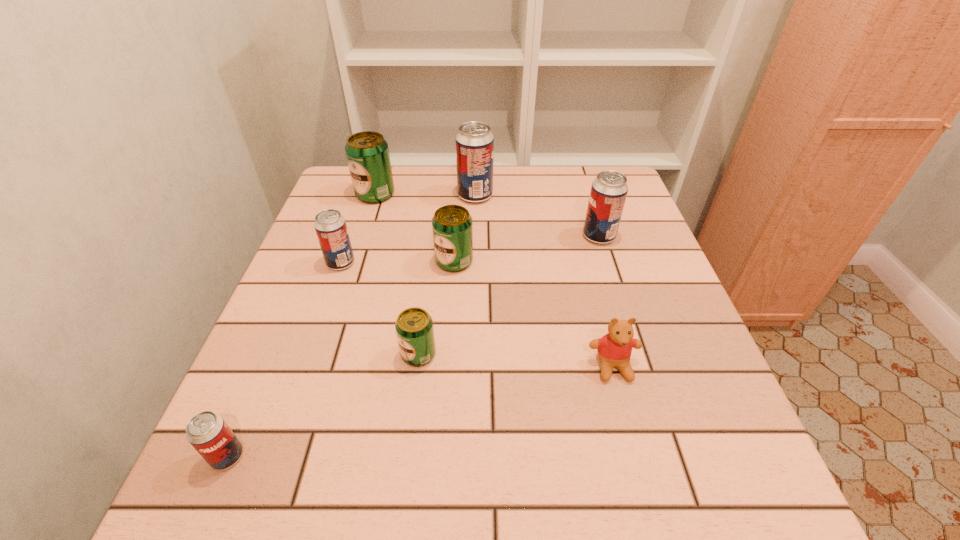
Find the location of a particular element. This screenshot has width=960, height=540. vacant point located on the front of the smallest green beer can is located at coordinates (403, 473).

Identify the location of free space located 0.350m on the right of the nearest red beer can. Image resolution: width=960 pixels, height=540 pixels. (468, 456).

Where is `object situated at the near edge`? The image size is (960, 540). object situated at the near edge is located at coordinates (207, 432).

At what (x,y) coordinates should I click in order to perform the action: click on beer can that is at the right edge. Please return your answer as a coordinate pair (x, y). This screenshot has width=960, height=540. Looking at the image, I should click on (609, 190).

Locate an element on the screen. This screenshot has height=540, width=960. teddy bear located at the right edge is located at coordinates (614, 349).

This screenshot has width=960, height=540. What are the coordinates of `object that is positioned at the far left corner` in the screenshot? It's located at (367, 152).

Locate an element on the screen. This screenshot has width=960, height=540. object located at the near left corner is located at coordinates (207, 432).

This screenshot has width=960, height=540. In the image, there is a desktop. Find the location of `vacant space at the far edge`. vacant space at the far edge is located at coordinates (417, 211).

Locate an element on the screen. vacant space at the near edge is located at coordinates (350, 466).

In the image, there is a desktop. Where is `vacant region at the left edge`? This screenshot has height=540, width=960. vacant region at the left edge is located at coordinates (310, 256).